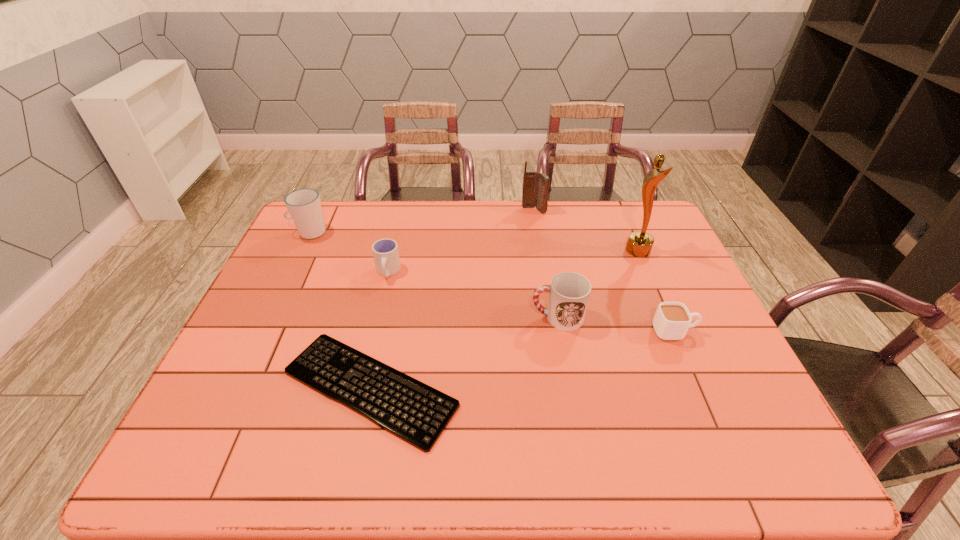
The image size is (960, 540). I want to click on free point between the sixth tallest object and the leftmost cup, so click(x=492, y=282).

At what (x,y) coordinates should I click in order to perform the action: click on empty location between the sixth tallest object and the farthest cup. Please return your answer as a coordinate pair (x, y). This screenshot has width=960, height=540. Looking at the image, I should click on (492, 282).

Find the location of a particular element. The image size is (960, 540). free space that is in between the second shortest cup and the farthest cup is located at coordinates (348, 252).

Where is `free point between the award and the leftmost cup`? free point between the award and the leftmost cup is located at coordinates (474, 241).

Where is `unoccupied position between the cellular telephone and the leftmost object`? unoccupied position between the cellular telephone and the leftmost object is located at coordinates (421, 221).

The width and height of the screenshot is (960, 540). What are the coordinates of `free area in between the third cup from left to right and the third tallest cup` in the screenshot? It's located at (472, 294).

Where is `vacant area between the third shortest cup and the sixth tallest object`? vacant area between the third shortest cup and the sixth tallest object is located at coordinates point(616,324).

You are a GUI agent. You are given a task and a screenshot of the screen. Output one action in this format:
    pyautogui.click(x=<x>, y=<y>)
    Task: Click on the vacant area that lies between the third cup from right to left and the third shortest cup
    Image resolution: width=960 pixels, height=540 pixels.
    Given the screenshot: What is the action you would take?
    pyautogui.click(x=472, y=294)

This screenshot has width=960, height=540. Identify the location of object that can be found as the sixth closest to the second cup from right to left. (304, 206).

The width and height of the screenshot is (960, 540). Identify the location of object that is the sixth nearest to the farthest object. (304, 206).